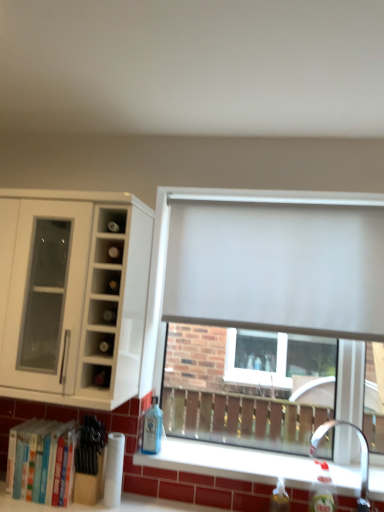
Question: Considering the relative sizes of white matte cabinet at left and white matte window at center in the image provided, is white matte cabinet at left shorter than white matte window at center?

Choices:
 (A) no
 (B) yes

Answer: (B)

Question: From a real-world perspective, is white matte cabinet at left below white matte window at center?

Choices:
 (A) yes
 (B) no

Answer: (B)

Question: Is white matte window at center at the back of white matte cabinet at left?

Choices:
 (A) no
 (B) yes

Answer: (A)

Question: Would you say white matte cabinet at left is outside white matte window at center?

Choices:
 (A) no
 (B) yes

Answer: (B)

Question: Is there a large distance between white matte cabinet at left and white matte window at center?

Choices:
 (A) no
 (B) yes

Answer: (A)

Question: Is white matte window at center a part of white matte cabinet at left?

Choices:
 (A) yes
 (B) no

Answer: (B)

Question: Are blue glass bottle at lower center, positioned as the third bottle in front-to-back order, and translucent plastic bottle at lower right, marked as the 2th bottle in a left-to-right arrangement, far apart?

Choices:
 (A) yes
 (B) no

Answer: (B)

Question: Does blue glass bottle at lower center, the first bottle viewed from the back, have a smaller size compared to translucent plastic bottle at lower right, positioned as the second bottle in back-to-front order?

Choices:
 (A) yes
 (B) no

Answer: (A)

Question: Is translucent plastic bottle at lower right, which is the 2th bottle in front-to-back order, completely or partially inside blue glass bottle at lower center, marked as the 1th bottle in a left-to-right arrangement?

Choices:
 (A) yes
 (B) no

Answer: (B)

Question: Does blue glass bottle at lower center, positioned as the third bottle in front-to-back order, lie behind translucent plastic bottle at lower right, which is the second bottle in right-to-left order?

Choices:
 (A) yes
 (B) no

Answer: (A)

Question: Is blue glass bottle at lower center, the 3th bottle in the right-to-left sequence, next to translucent plastic bottle at lower right, which is the second bottle in right-to-left order, and touching it?

Choices:
 (A) yes
 (B) no

Answer: (B)

Question: Is blue glass bottle at lower center, the 3th bottle in the right-to-left sequence, positioned beyond the bounds of translucent plastic bottle at lower right, which is the 2th bottle in front-to-back order?

Choices:
 (A) yes
 (B) no

Answer: (A)

Question: Does hardcover books at lower left have a greater height compared to matte white wine rack at upper left?

Choices:
 (A) yes
 (B) no

Answer: (A)